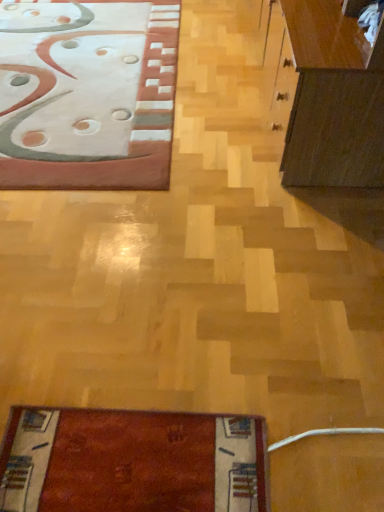
Question: Considering the positions of point (306, 162) and point (89, 34), is point (306, 162) closer or farther from the camera than point (89, 34)?

Choices:
 (A) farther
 (B) closer

Answer: (B)

Question: Considering their positions, is dark brown wood cabinet at right located in front of or behind matte pink rug at upper left?

Choices:
 (A) front
 (B) behind

Answer: (A)

Question: Is dark brown wood cabinet at right bigger or smaller than matte pink rug at upper left?

Choices:
 (A) small
 (B) big

Answer: (B)

Question: Is matte pink rug at upper left inside the boundaries of dark brown wood cabinet at right, or outside?

Choices:
 (A) outside
 (B) inside

Answer: (A)

Question: Is matte pink rug at upper left in front of or behind dark brown wood cabinet at right in the image?

Choices:
 (A) behind
 (B) front

Answer: (A)

Question: Is point (31, 64) positioned closer to the camera than point (367, 181)?

Choices:
 (A) closer
 (B) farther

Answer: (B)

Question: From a real-world perspective, relative to dark brown wood cabinet at right, is matte pink rug at upper left vertically above or below?

Choices:
 (A) above
 (B) below

Answer: (B)